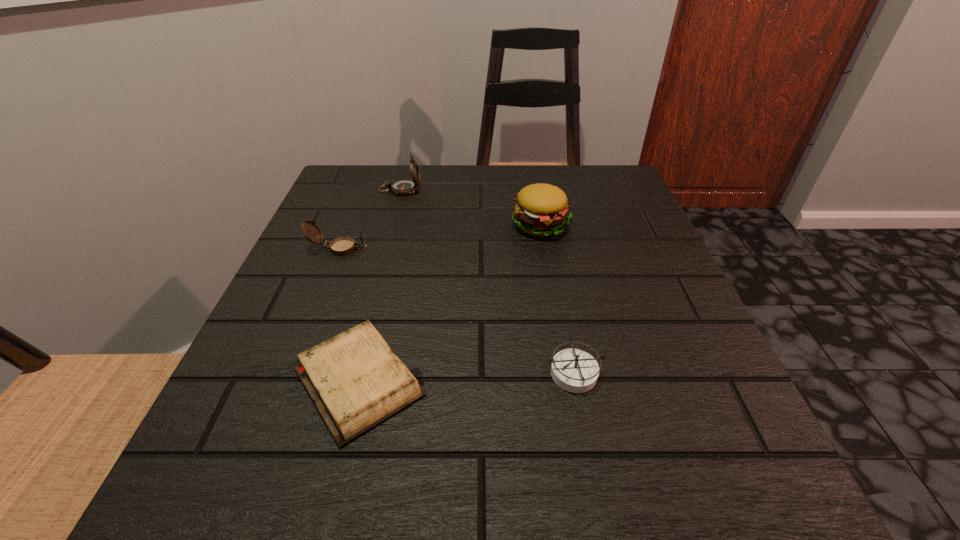
The image size is (960, 540). I want to click on the farthest compass, so [x=403, y=186].

Identify the location of the farthest object. (403, 186).

Identify the location of hamburger. [x=541, y=210].

The height and width of the screenshot is (540, 960). Identify the location of the second shortest compass. (342, 246).

I want to click on the second farthest compass, so click(x=342, y=246).

The height and width of the screenshot is (540, 960). Find the location of `the nearest compass`. the nearest compass is located at coordinates (574, 370).

Find the location of a particular element. Image resolution: width=960 pixels, height=540 pixels. the shortest compass is located at coordinates (574, 370).

Where is `the shortest object`? The width and height of the screenshot is (960, 540). the shortest object is located at coordinates (356, 381).

Find the location of a particular element. vacant space located on the face of the farthest compass is located at coordinates (485, 190).

Locate an element on the screen. The image size is (960, 540). vacant point located 0.250m on the left of the hamburger is located at coordinates (393, 225).